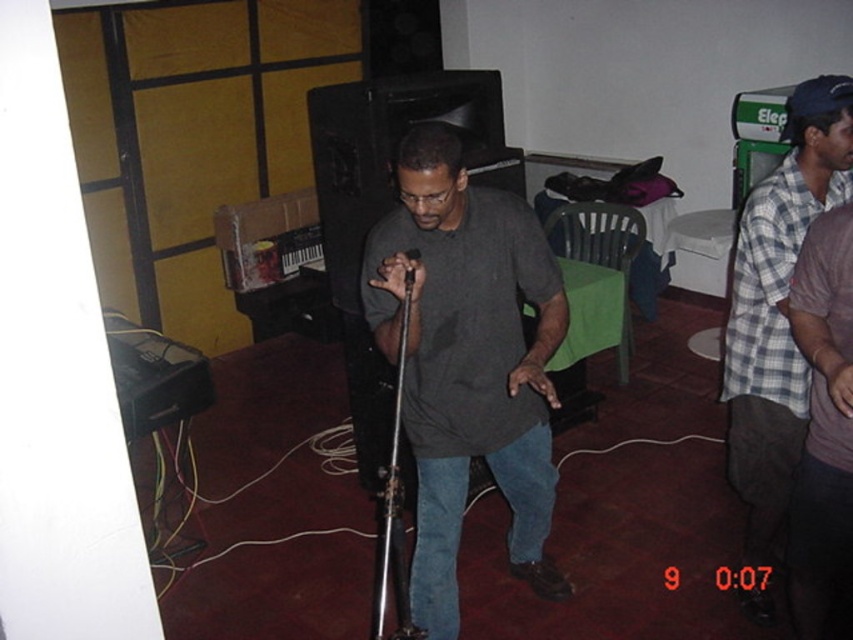
You are organizing a small concert and need to ensure that the plaid shirt at right and the metallic silver microphone at center can fit side by side on a 1.2 meter wide stage. Based on their widths, will they both fit?

The plaid shirt at right is wider than the metallic silver microphone at center. However, without knowing the exact widths of both items, it is impossible to determine if they will fit on the 1.2 meter stage. Additional measurements are needed.

You are a stagehand setting up for a performance. You need to place a 1.2 meter tall stand between the plaid shirt at right and the metallic silver microphone at center. Will the stand fit vertically between them?

The plaid shirt at right is much taller than the metallic silver microphone at center. Since the stand is 1.2 meters tall, it may not fit vertically between them if the space between their heights is less than 1.2 meters. However, without exact height measurements, it is difficult to determine for sure.

You are a photographer setting up for a live performance. You need to adjust the lighting to ensure both the dark gray matte shirt at center and the plaid shirt at right are well lit. Given their sizes, which shirt might require more focused lighting to avoid being overshadowed?

The plaid shirt at right might require more focused lighting since it is smaller than the dark gray matte shirt at center and could be overshadowed if not properly lit.